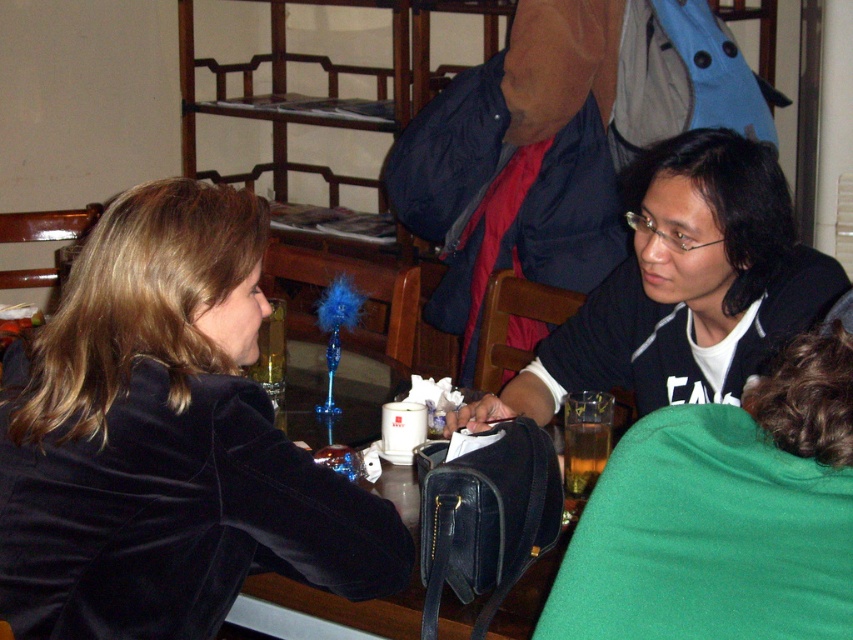
Is the position of black matte jacket at center more distant than that of wooden bunk bed at upper center?

That is False.

Between point (718, 168) and point (323, 60), which one is positioned in front?

Point (718, 168)

Image resolution: width=853 pixels, height=640 pixels. Identify the location of black matte jacket at center. (682, 288).

Locate an element on the screen. The image size is (853, 640). velvet black jacket at left is located at coordinates (165, 440).

Between point (103, 406) and point (746, 324), which one is positioned in front?

Point (103, 406) is more forward.

What are the coordinates of `velvet black jacket at left` in the screenshot? It's located at (165, 440).

Is velvet black jacket at left positioned before wooden bunk bed at upper center?

Yes, velvet black jacket at left is closer to the viewer.

Between velvet black jacket at left and wooden bunk bed at upper center, which one is positioned higher?

wooden bunk bed at upper center is higher up.

Where is `velvet black jacket at left`? The image size is (853, 640). velvet black jacket at left is located at coordinates (165, 440).